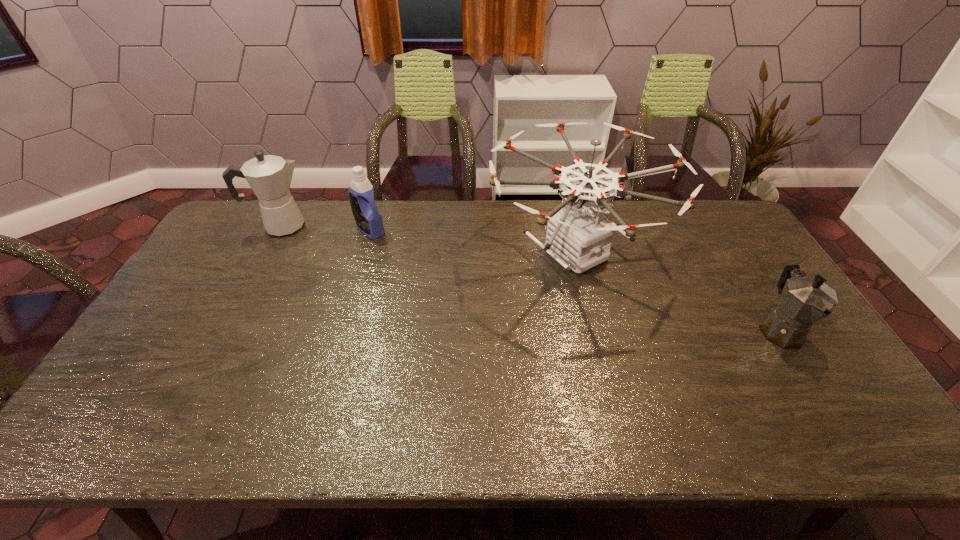
You are a GUI agent. You are given a task and a screenshot of the screen. Output one action in this format:
    pyautogui.click(x=<x>, y=<y>)
    Task: Click on the vacant space located 0.160m on the pouring side of the nearer coffeepot
    
    Given the screenshot: What is the action you would take?
    pyautogui.click(x=832, y=414)

The height and width of the screenshot is (540, 960). Find the location of `drone that is positioned at the far edge`. drone that is positioned at the far edge is located at coordinates (578, 234).

Image resolution: width=960 pixels, height=540 pixels. In order to click on coffeepot present at the far edge in this screenshot , I will do `click(269, 176)`.

Identify the location of detergent at the far edge. (368, 219).

Find the location of a particular element. This screenshot has height=540, width=960. object at the left edge is located at coordinates (269, 176).

Locate an element on the screen. object that is at the right edge is located at coordinates (804, 300).

I want to click on object at the far left corner, so click(x=269, y=176).

The image size is (960, 540). Find the location of `vacant area at the far edge`. vacant area at the far edge is located at coordinates (510, 241).

You are a GUI agent. You are given a task and a screenshot of the screen. Output one action in this format:
    pyautogui.click(x=<x>, y=<y>)
    Task: Click on the vacant position at the near edge of the desktop
    The width and height of the screenshot is (960, 540).
    Given the screenshot: What is the action you would take?
    (x=741, y=439)

In the image, there is a desktop. At what (x,y) coordinates should I click in order to perform the action: click on vacant area at the right edge. Please return your answer as a coordinate pair (x, y). This screenshot has width=960, height=540. Looking at the image, I should click on (743, 278).